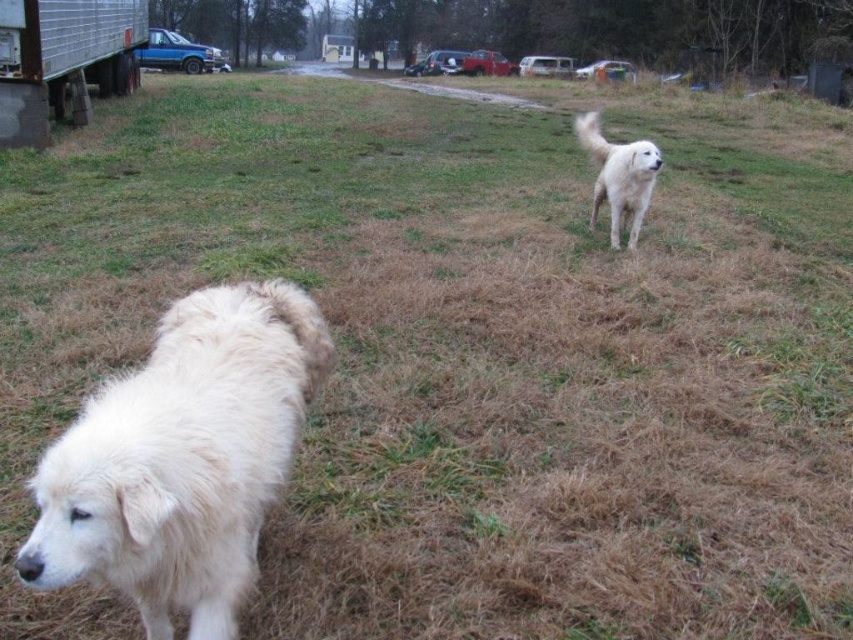
Question: Which of the following is the closest to the observer?

Choices:
 (A) white fluffy dog at upper right
 (B) white fluffy dog at lower left

Answer: (B)

Question: Is white fluffy dog at lower left smaller than white fluffy dog at upper right?

Choices:
 (A) yes
 (B) no

Answer: (A)

Question: Among these objects, which one is nearest to the camera?

Choices:
 (A) white fluffy dog at lower left
 (B) white fluffy dog at upper right

Answer: (A)

Question: Can you confirm if white fluffy dog at lower left is bigger than white fluffy dog at upper right?

Choices:
 (A) yes
 (B) no

Answer: (B)

Question: Which of the following is the closest to the observer?

Choices:
 (A) white fluffy dog at lower left
 (B) white fluffy dog at upper right

Answer: (A)

Question: Can you confirm if white fluffy dog at lower left is positioned below white fluffy dog at upper right?

Choices:
 (A) no
 (B) yes

Answer: (B)